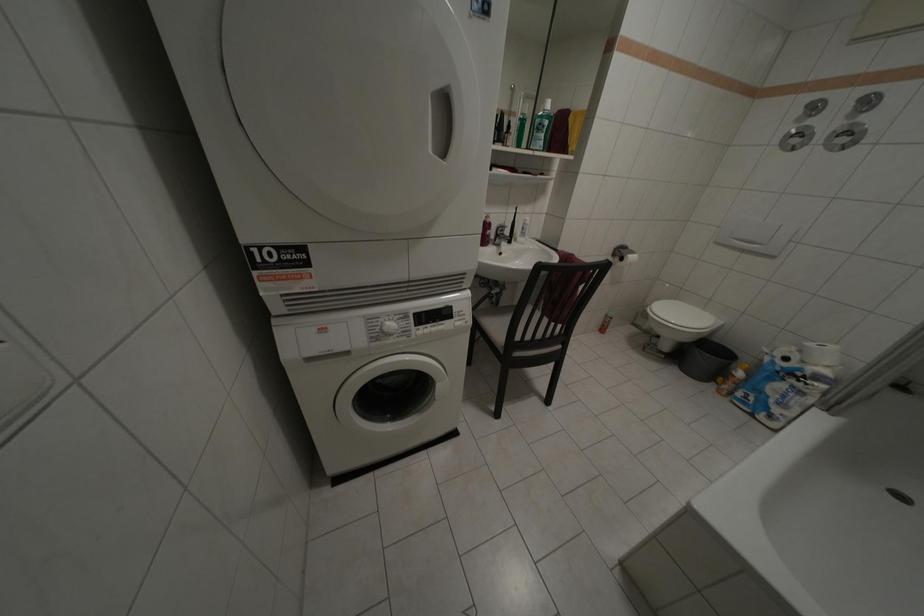
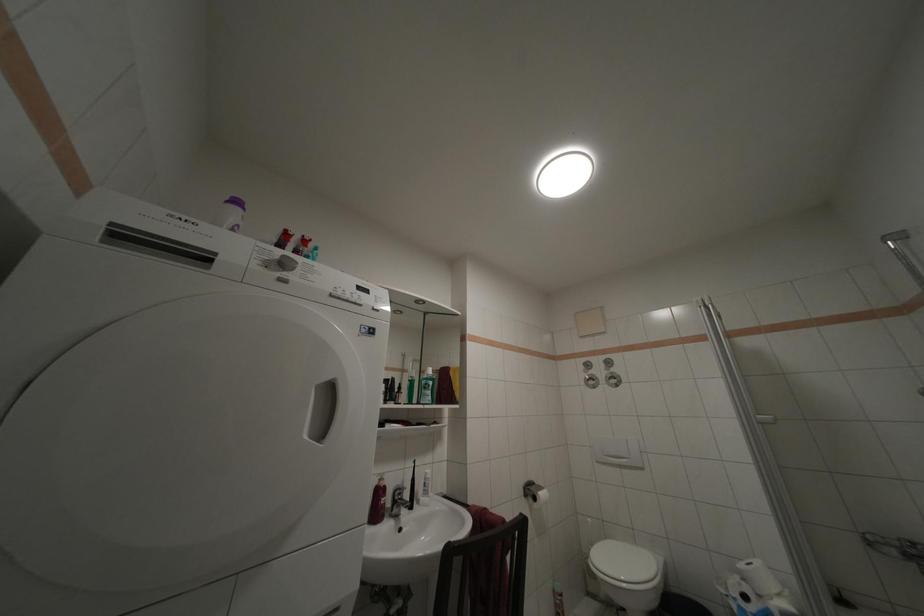
Based on the continuous images, in which direction is the camera rotating?

The camera's rotation is toward right-up.